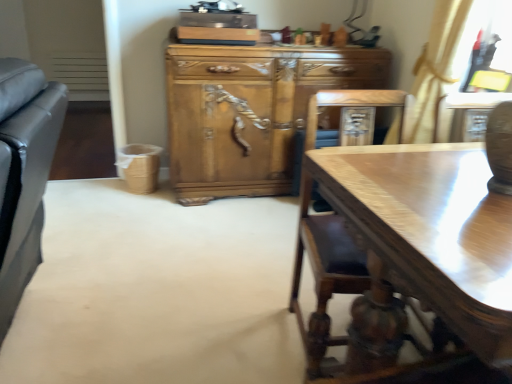
Question: Do you think light brown wood cabinet at center is within glossy wood desk at lower right, or outside of it?

Choices:
 (A) outside
 (B) inside

Answer: (A)

Question: Looking at their shapes, would you say light brown wood cabinet at center is wider or thinner than glossy wood desk at lower right?

Choices:
 (A) wide
 (B) thin

Answer: (A)

Question: In terms of size, does light brown wood cabinet at center appear bigger or smaller than glossy wood desk at lower right?

Choices:
 (A) big
 (B) small

Answer: (A)

Question: In terms of width, does glossy wood desk at lower right look wider or thinner when compared to light brown wood cabinet at center?

Choices:
 (A) wide
 (B) thin

Answer: (B)

Question: Considering the relative positions of glossy wood desk at lower right and light brown wood cabinet at center in the image provided, is glossy wood desk at lower right to the left or to the right of light brown wood cabinet at center?

Choices:
 (A) left
 (B) right

Answer: (B)

Question: From the image's perspective, is glossy wood desk at lower right located above or below light brown wood cabinet at center?

Choices:
 (A) below
 (B) above

Answer: (A)

Question: From a real-world perspective, is glossy wood desk at lower right physically located above or below light brown wood cabinet at center?

Choices:
 (A) above
 (B) below

Answer: (A)